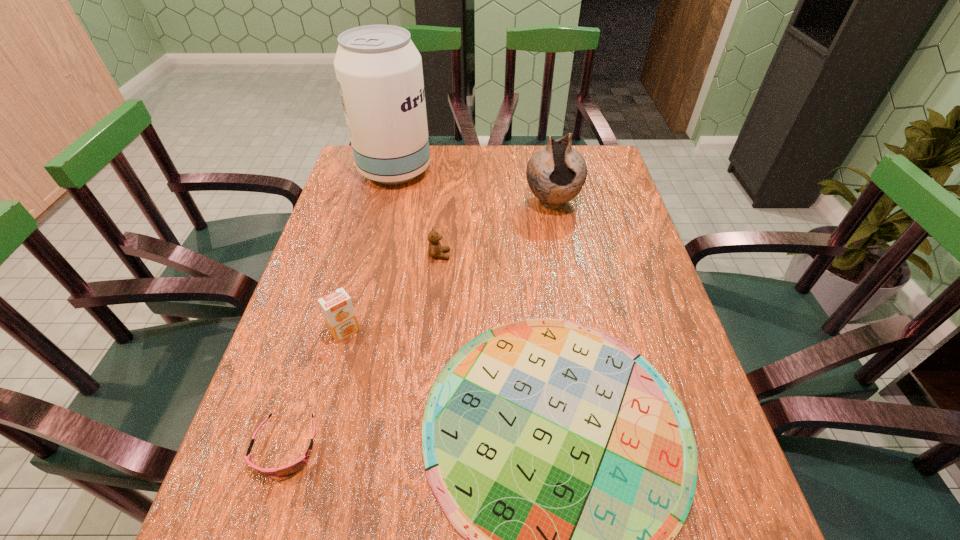
Where is `the tallest object`? The image size is (960, 540). the tallest object is located at coordinates (379, 72).

You are a GUI agent. You are given a task and a screenshot of the screen. Output one action in this format:
    pyautogui.click(x=<x>, y=<y>)
    Task: Click on the pottery
    This screenshot has height=540, width=960.
    Given the screenshot: What is the action you would take?
    pyautogui.click(x=556, y=173)

At what (x,y) coordinates should I click in order to perform the action: click on the fourth shortest object. Please return your answer as a coordinate pair (x, y). Image resolution: width=960 pixels, height=540 pixels. Looking at the image, I should click on (337, 308).

You are a GUI agent. You are given a task and a screenshot of the screen. Output one action in this format:
    pyautogui.click(x=<x>, y=<y>)
    Task: Click on the teddy bear
    
    Given the screenshot: What is the action you would take?
    pyautogui.click(x=435, y=250)

Where is `the third shortest object`? The image size is (960, 540). the third shortest object is located at coordinates (435, 250).

Where is `the fifth tallest object`? the fifth tallest object is located at coordinates (292, 468).

Locate an element on the screen. Image resolution: width=960 pixels, height=540 pixels. vacant area located 0.310m on the front of the alcohol is located at coordinates (373, 261).

Find the location of `vacant space positioned 0.270m from the spout of the pottery`. vacant space positioned 0.270m from the spout of the pottery is located at coordinates (568, 289).

Find the location of a particular element. blank space located 0.060m on the right of the third tallest object is located at coordinates (387, 332).

Identify the location of vacant space located 0.330m on the front-facing side of the third farthest object. The width and height of the screenshot is (960, 540). (575, 255).